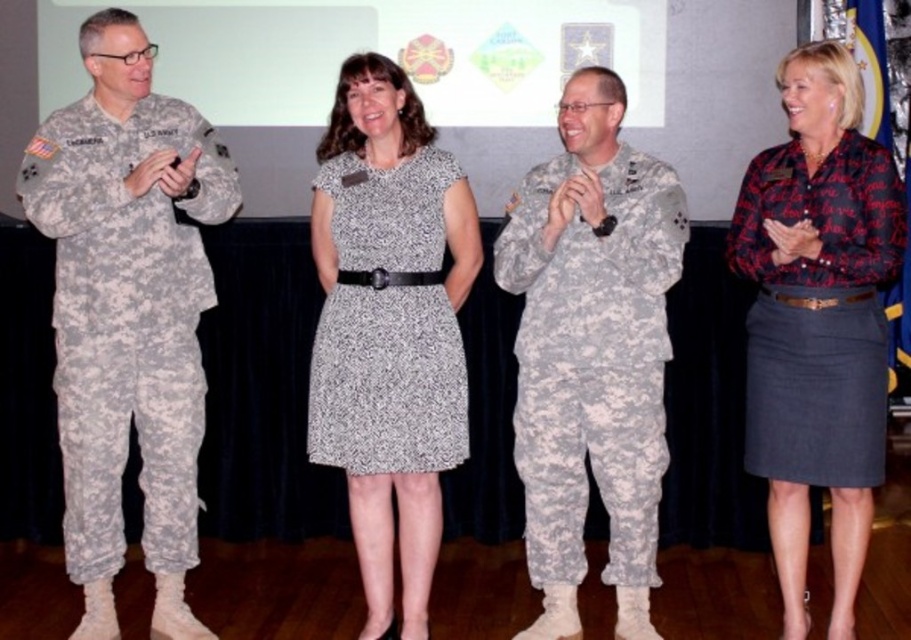
You are an event photographer who needs to capture a group photo of the camouflage uniform at center and the speckled fabric dress at center. From the photographer perspective, which one is positioned to the right side?

The camouflage uniform at center is positioned to the right of the speckled fabric dress at center, so from the photographer perspective, the camouflage uniform at center is on the right side.

You are a photographer at the event and need to ensure all participants are visible in the photo. The camouflage uniform at center and the speckled fabric dress at center are both at the center. Which one is taller?

The camouflage uniform at center is much taller than the speckled fabric dress at center, so the camouflage uniform at center will be more visible in the photo.

You are organizing a group photo and need to arrange the camouflage uniform at center and the printed cotton blouse at center side by side. Which one requires more space horizontally for the photo setup?

The camouflage uniform at center requires more space horizontally because its width is larger than the printed cotton blouse at center.